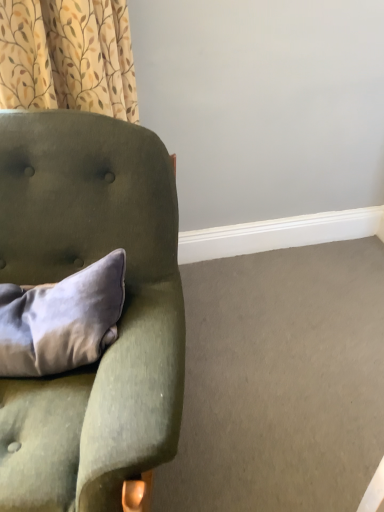
Question: In terms of width, does velvet green armchair at left look wider or thinner when compared to patterned fabric curtain at upper left?

Choices:
 (A) thin
 (B) wide

Answer: (B)

Question: Looking at the image, does velvet green armchair at left seem bigger or smaller compared to patterned fabric curtain at upper left?

Choices:
 (A) big
 (B) small

Answer: (A)

Question: Which is farther from the velvet green armchair at left?

Choices:
 (A) satin gray pillow at left
 (B) patterned fabric curtain at upper left

Answer: (B)

Question: Estimate the real-world distances between objects in this image. Which object is farther from the velvet green armchair at left?

Choices:
 (A) patterned fabric curtain at upper left
 (B) satin gray pillow at left

Answer: (A)